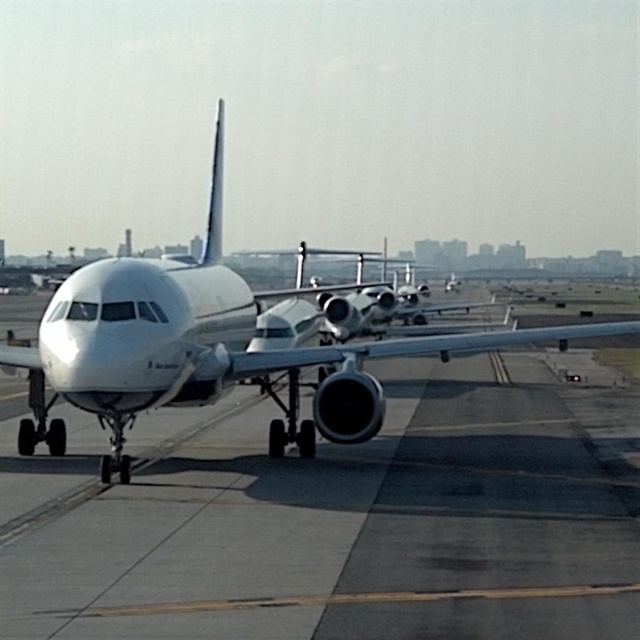
Question: Can you confirm if smooth concrete tarmac at center is positioned to the left of white matte airplane at center?

Choices:
 (A) yes
 (B) no

Answer: (B)

Question: Is smooth concrete tarmac at center to the left of white matte airplane at center from the viewer's perspective?

Choices:
 (A) no
 (B) yes

Answer: (A)

Question: Does smooth concrete tarmac at center have a lesser width compared to white matte airplane at center?

Choices:
 (A) yes
 (B) no

Answer: (B)

Question: Which of the following is the farthest from the observer?

Choices:
 (A) (323, 420)
 (B) (400, 544)

Answer: (A)

Question: Which object is closer to the camera taking this photo?

Choices:
 (A) white matte airplane at center
 (B) smooth concrete tarmac at center

Answer: (B)

Question: Which of the following is the closest to the observer?

Choices:
 (A) pos(164,264)
 (B) pos(493,461)

Answer: (B)